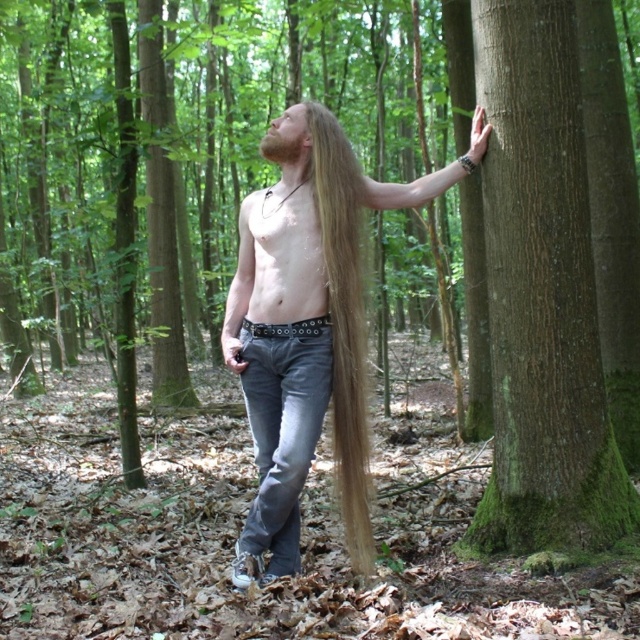
You are a photographer trying to capture a photo of the person in the forest. You notice two points in the scene labeled as point (515, 182) and point (291, 193). Which point should you focus on to ensure the person is in sharp focus?

You should focus on point (515, 182) because it is closer to the camera than point (291, 193), ensuring the person is in sharp focus.

You are a photographer trying to capture a portrait of the person in the forest. You want to ensure that both the blonde hair at center and the brown fuzzy beard at upper center are in focus. Given that your camera has a depth of field that can cover 30 inches, will both features be in focus?

The distance between the blonde hair at center and the brown fuzzy beard at upper center is 29.82 inches, which is within the camera lens depth of field range of 30 inches. Therefore, both features will be in focus.